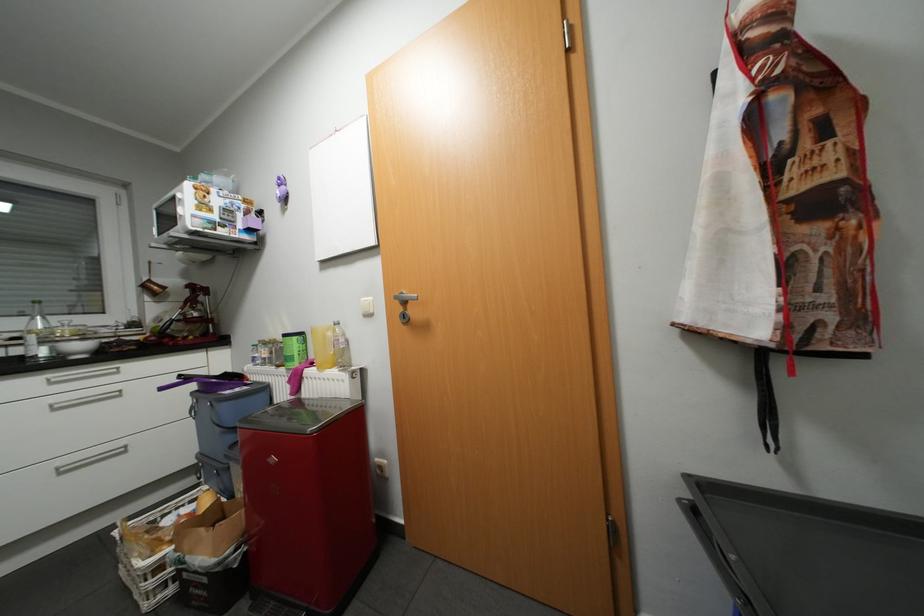
Find where to lift the clear plastic bottle. Please return your answer as a coordinate pair (x, y).

(35, 333)